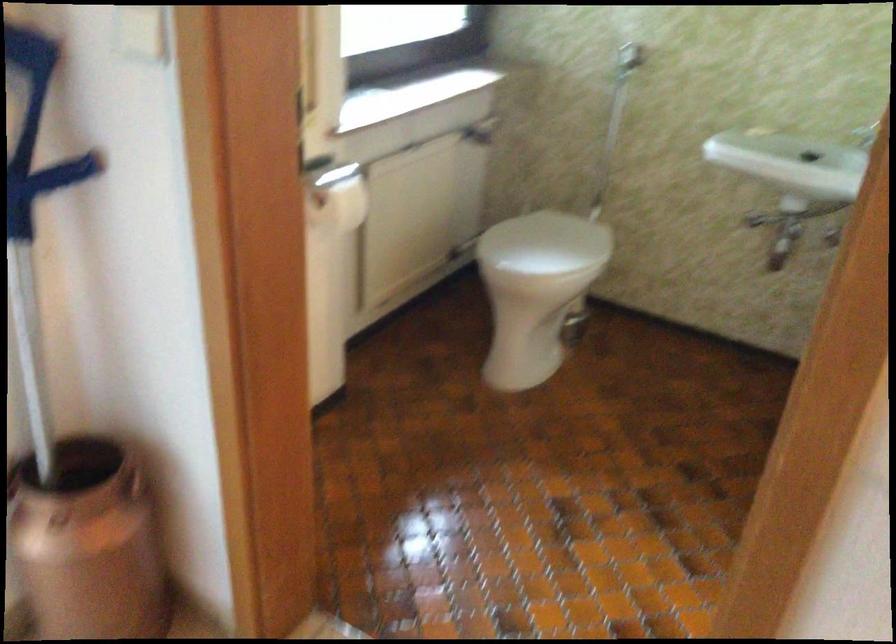
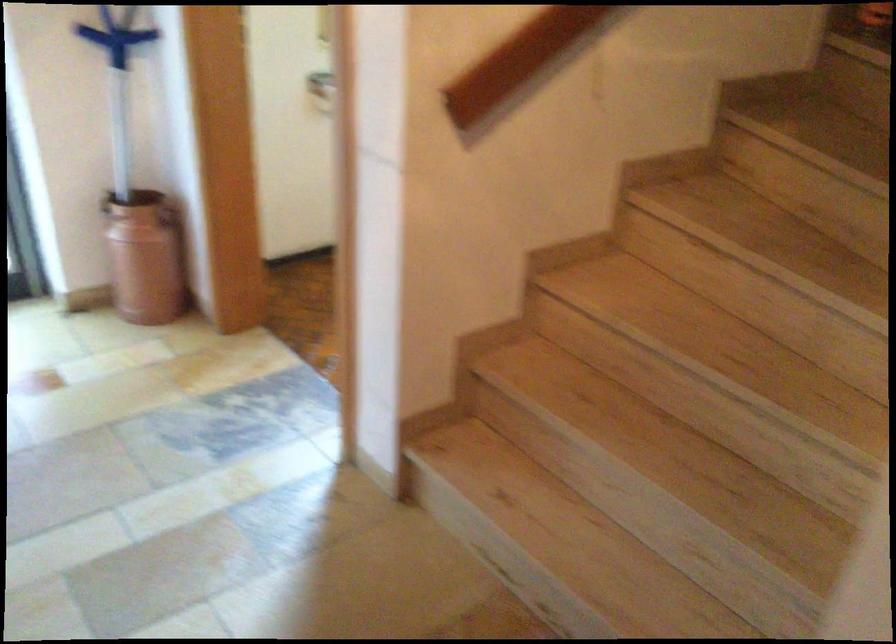
What movement of the cameraman would produce the second image?

The cameraman walked toward right, backward.